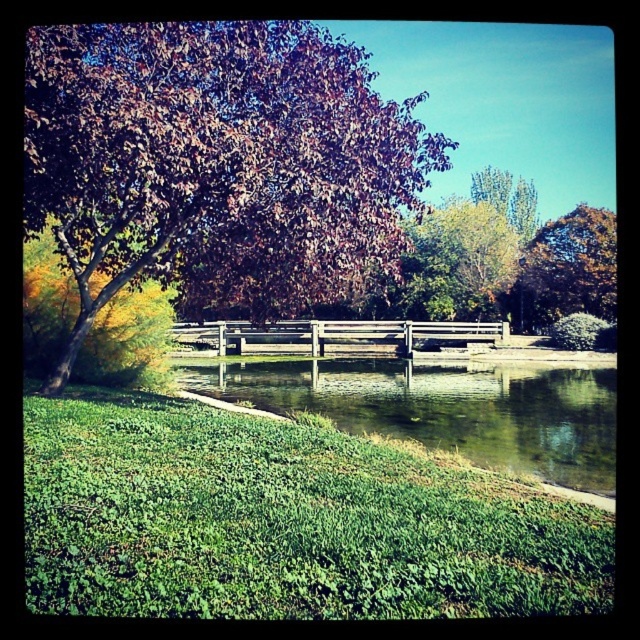
You are standing in the park and want to take a photo of both the prominent tree with deep purple and reddish leaves on the left and the calm body of water. You notice two points marked in the scene at coordinates point (296, 100) and point (424, 436). Which point should you position yourself closer to in order to ensure both the tree and the water are in focus?

You should position yourself closer to point (296, 100) because it is closer to the camera than point (424, 436), allowing for better focus on both the prominent tree with deep purple and reddish leaves on the left and the calm body of water.

You are a photographer standing in the park and want to take a photo of the shiny brown tree at upper left and the green reflective water at center. Which object will appear larger in your photo?

The shiny brown tree at upper left will appear larger in the photo because it is closer to the viewer than the green reflective water at center.

You are planning to place a 2.5 meters long wooden bench at center in the park. The brown textured tree at upper right has a trunk width of 1.2 meters. Based on the scene description, will the bench be wider than the tree?

The wooden bench at center is wider than brown textured tree at upper right, so yes, the bench will be wider than the tree.